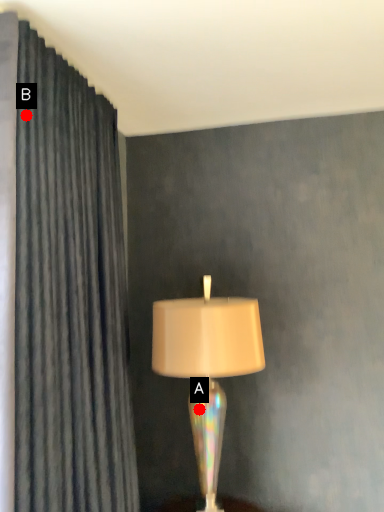
Question: Two points are circled on the image, labeled by A and B beside each circle. Among these points, which one is nearest to the camera?

Choices:
 (A) A is closer
 (B) B is closer

Answer: (B)